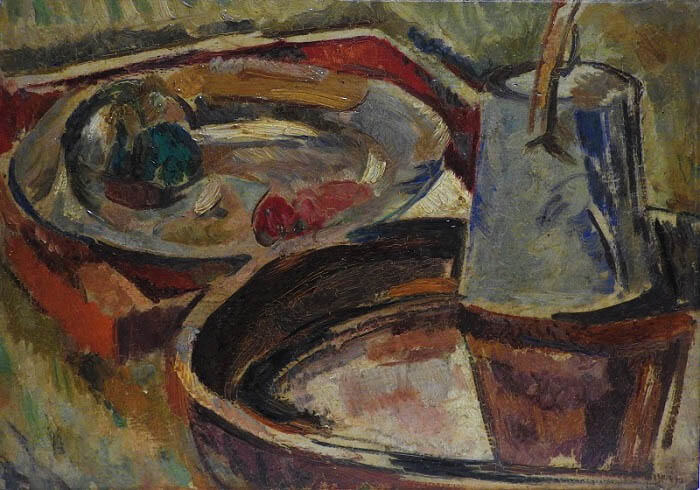
Find the location of a particular element. The width and height of the screenshot is (700, 490). mug is located at coordinates (594, 413).